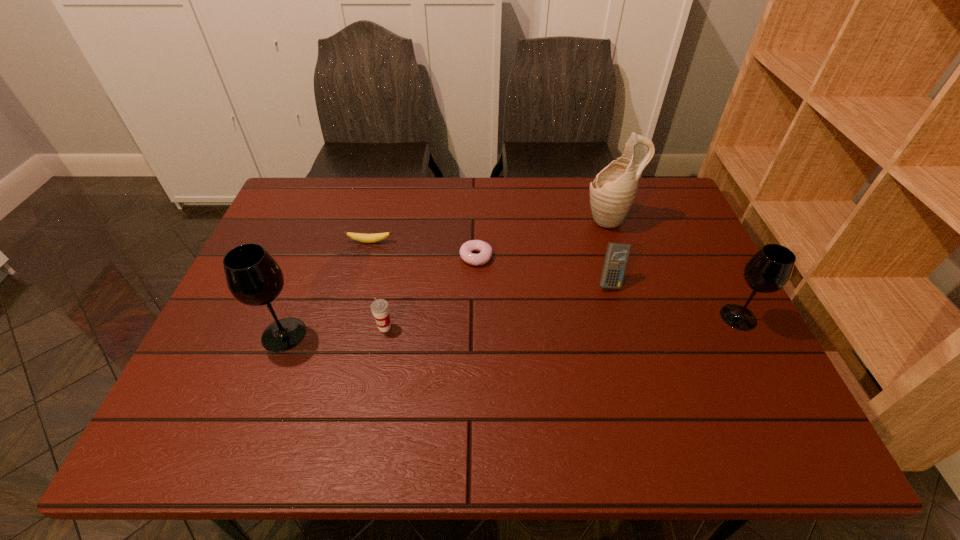
Please mark a free spot for a new wineglass to balance the arrangement. Please provide its 2D coordinates. Your answer should be formatted as a tuple, i.e. [(x, y)], where the tuple contains the x and y coordinates of a point satisfying the conditions above.

[(515, 326)]